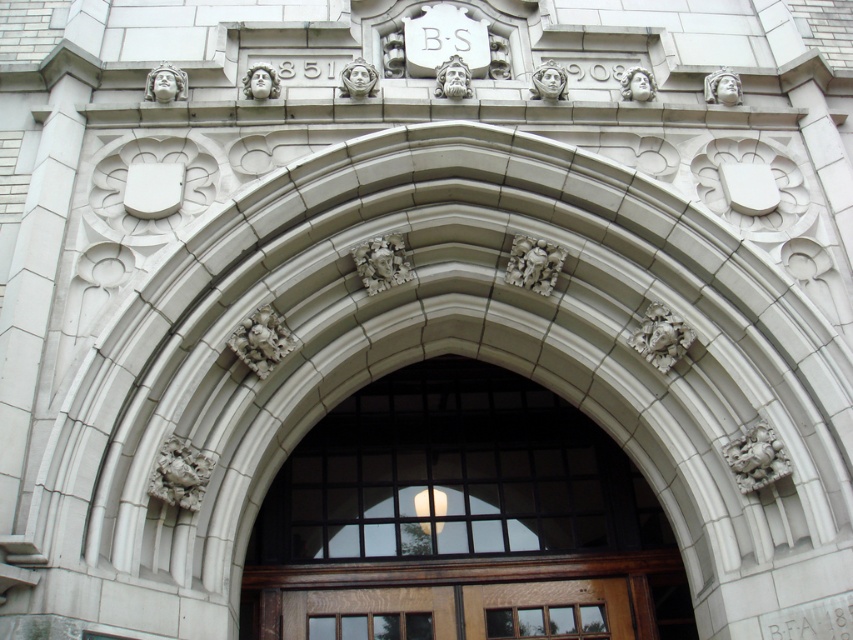
Question: Does wooden door at center have a greater width compared to mahogany wood door at center?

Choices:
 (A) yes
 (B) no

Answer: (A)

Question: Which of the following is the closest to the observer?

Choices:
 (A) (662, 515)
 (B) (515, 596)

Answer: (B)

Question: Is wooden door at center behind mahogany wood door at center?

Choices:
 (A) yes
 (B) no

Answer: (A)

Question: Can you confirm if wooden door at center is positioned to the right of mahogany wood door at center?

Choices:
 (A) yes
 (B) no

Answer: (A)

Question: Among these objects, which one is farthest from the camera?

Choices:
 (A) mahogany wood door at center
 (B) wooden door at center

Answer: (B)